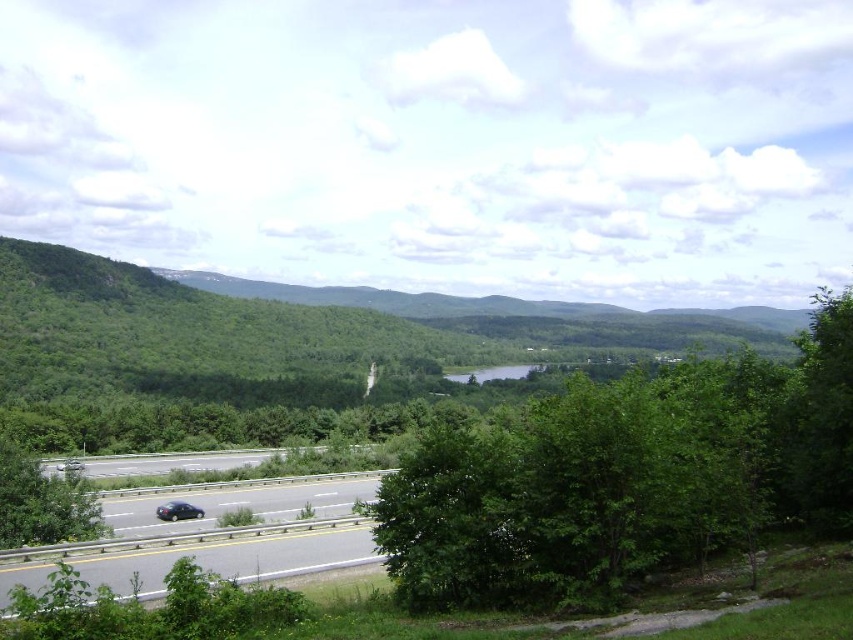
Which is more to the left, green leafy tree at center or shiny black sedan at lower left?

Positioned to the left is shiny black sedan at lower left.

Is green leafy tree at center thinner than shiny black sedan at lower left?

No, green leafy tree at center is not thinner than shiny black sedan at lower left.

Does point (711, 506) lie behind point (164, 508)?

No, it is not.

The height and width of the screenshot is (640, 853). Find the location of `green leafy tree at center`. green leafy tree at center is located at coordinates (624, 477).

Who is taller, black asphalt highway at lower left or shiny black sedan at lower left?

black asphalt highway at lower left is taller.

Does point (152, 515) come farther from viewer compared to point (165, 502)?

No, it is in front of (165, 502).

The height and width of the screenshot is (640, 853). What are the coordinates of `black asphalt highway at lower left` in the screenshot? It's located at click(213, 540).

At what (x,y) coordinates should I click in order to perform the action: click on black asphalt highway at lower left. Please return your answer as a coordinate pair (x, y). The width and height of the screenshot is (853, 640). Looking at the image, I should click on (213, 540).

Which is behind, point (514, 520) or point (194, 540)?

Positioned behind is point (194, 540).

Who is more forward, [773,420] or [305,550]?

→ Point [773,420] is more forward.

Locate an element on the screen. green leafy tree at center is located at coordinates (624, 477).